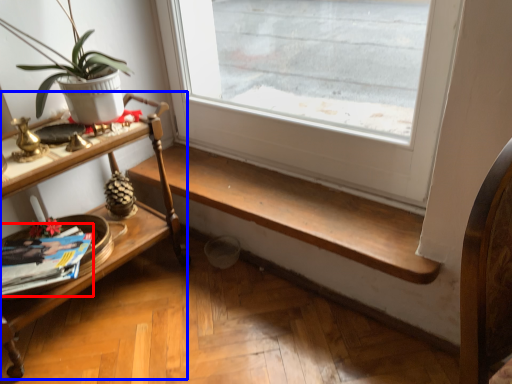
Question: Which object appears farthest to the camera in this image, magazine (highlighted by a red box) or shelf (highlighted by a blue box)?

Choices:
 (A) magazine
 (B) shelf

Answer: (A)